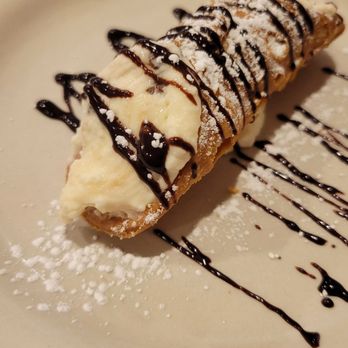
Where is `sauce on plate`? sauce on plate is located at coordinates (254, 292), (325, 279), (307, 230), (309, 220), (309, 188), (327, 146).